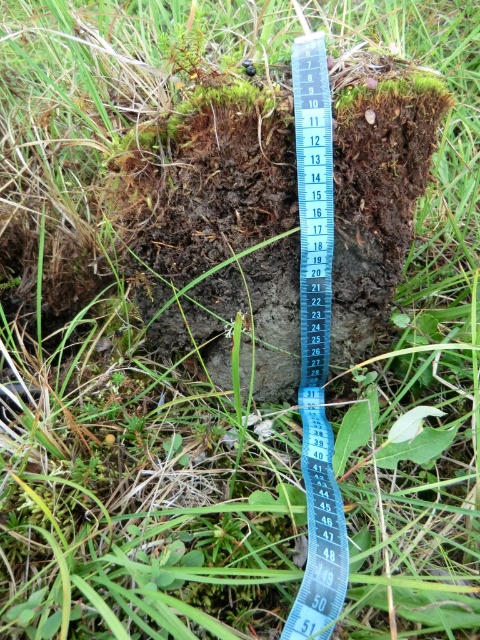
Can you confirm if brown soil at center is positioned to the right of blue plastic tape measure at center?

Incorrect, brown soil at center is not on the right side of blue plastic tape measure at center.

In the scene shown: Is brown soil at center wider than blue plastic tape measure at center?

Correct, the width of brown soil at center exceeds that of blue plastic tape measure at center.

Which is in front, point (380, 296) or point (317, 92)?

Point (317, 92) is more forward.

Locate an element on the screen. The image size is (480, 640). brown soil at center is located at coordinates (219, 230).